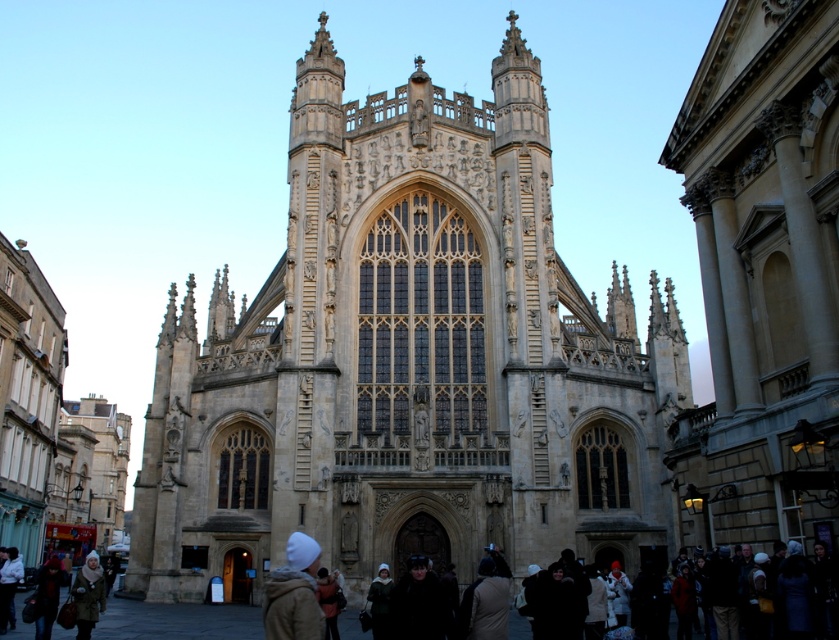
Does white woolen hat at lower center appear under fluffy white hat at lower left?

No, white woolen hat at lower center is not below fluffy white hat at lower left.

Locate an element on the screen. The width and height of the screenshot is (839, 640). white woolen hat at lower center is located at coordinates (294, 593).

Does point (654, 529) come closer to viewer compared to point (315, 552)?

That is False.

Who is shorter, beige stone church at center or white woolen hat at lower center?

Standing shorter between the two is white woolen hat at lower center.

Is point (183, 435) less distant than point (263, 616)?

No, it is not.

I want to click on beige stone church at center, so click(408, 360).

Can you confirm if beige stone church at center is positioned above fluffy white hat at lower left?

Yes.

The image size is (839, 640). What do you see at coordinates (408, 360) in the screenshot?
I see `beige stone church at center` at bounding box center [408, 360].

Where is `beige stone church at center`? The width and height of the screenshot is (839, 640). beige stone church at center is located at coordinates (408, 360).